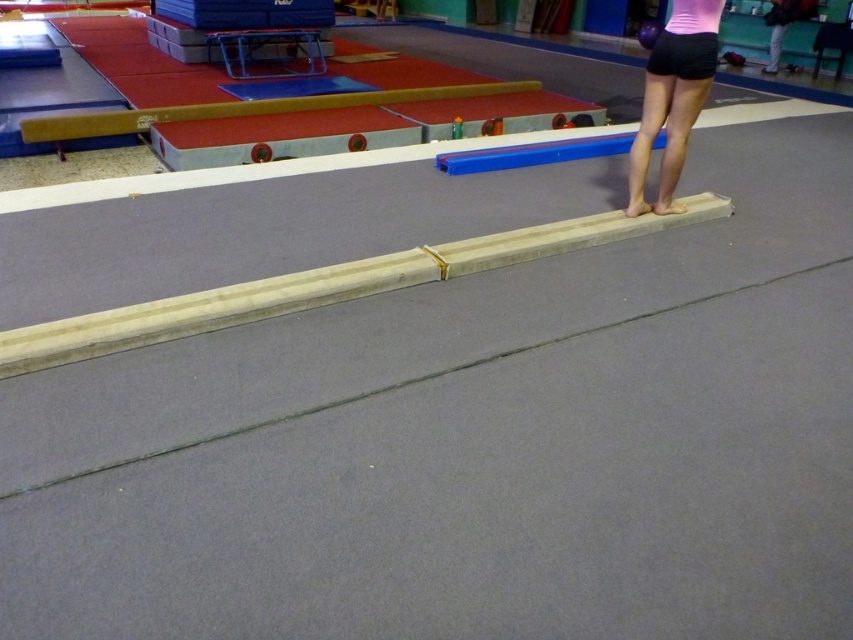
Is smooth wood beam at center taller than wooden gymnastics beam at upper center?

In fact, smooth wood beam at center may be shorter than wooden gymnastics beam at upper center.

Which is below, smooth wood beam at center or wooden gymnastics beam at upper center?

smooth wood beam at center

Does point (90, 323) come farther from viewer compared to point (141, 109)?

No.

Where is `smooth wood beam at center`? This screenshot has height=640, width=853. smooth wood beam at center is located at coordinates (322, 285).

Does point (88, 317) lie behind point (662, 51)?

No, it is not.

Which of these two, smooth wood beam at center or black fabric shorts at upper right, stands taller?

Standing taller between the two is smooth wood beam at center.

This screenshot has width=853, height=640. I want to click on smooth wood beam at center, so click(x=322, y=285).

Can you confirm if black matte shorts at right is wider than black fabric shorts at upper right?

Yes.

Does point (703, 93) come behind point (688, 67)?

Yes, it is behind point (688, 67).

Where is `black matte shorts at right`? Image resolution: width=853 pixels, height=640 pixels. black matte shorts at right is located at coordinates (672, 97).